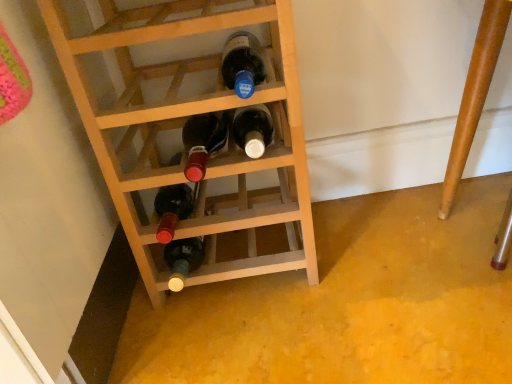
The height and width of the screenshot is (384, 512). Find the location of `wooden wine rack at center`. wooden wine rack at center is located at coordinates (182, 125).

What is the approximate height of wooden wine rack at center?

It is 22.76 inches.

Describe the element at coordinates (182, 125) in the screenshot. This screenshot has height=384, width=512. I see `wooden wine rack at center` at that location.

Locate an element on the screen. Image resolution: width=512 pixels, height=384 pixels. wooden wine rack at center is located at coordinates (182, 125).